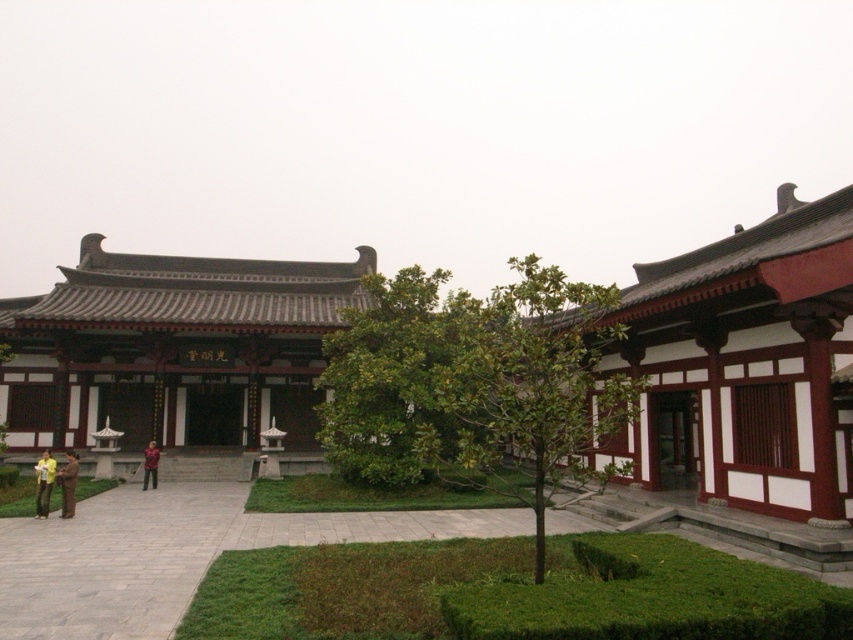
You are a visitor standing in the courtyard and want to walk from the gray stone path at center to the entrance of the matte brown wooden palace at center. Which direction should you move relative to the palace?

Since the matte brown wooden palace at center is wider than the gray stone path at center, you should move towards the palace along the path to reach its entrance.

You are standing in the courtyard of the traditional East Asian building. You see a white wood palace at right and a yellow cotton shirt at lower left. Which object is located to the right of the other?

The white wood palace at right is positioned on the right side of yellow cotton shirt at lower left.